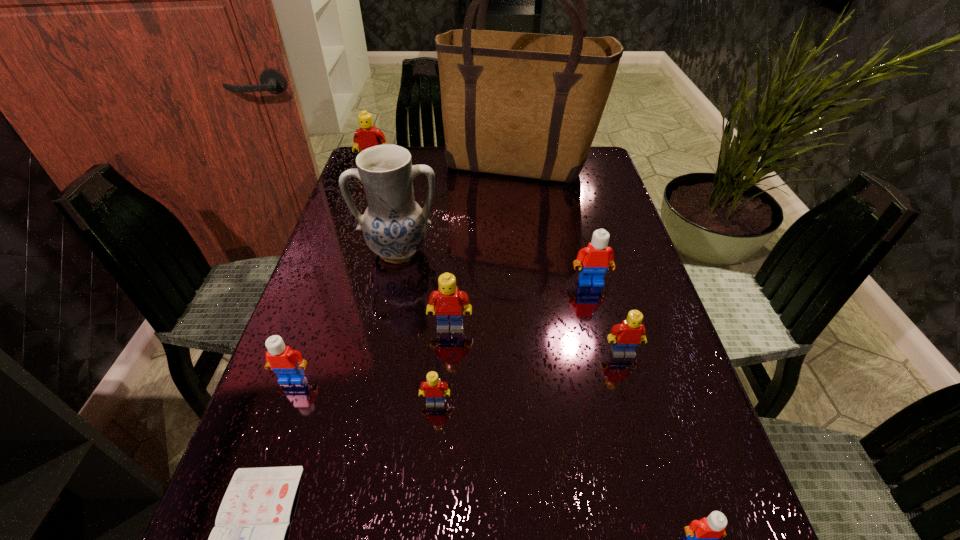
The image size is (960, 540). I want to click on the leftmost white Lego, so click(x=286, y=363).

Find the location of a particular element. The height and width of the screenshot is (540, 960). the rightmost yellow Lego is located at coordinates point(626,336).

Locate an element on the screen. the third biggest yellow Lego is located at coordinates (626, 336).

Where is `the nearest yellow Lego`? This screenshot has height=540, width=960. the nearest yellow Lego is located at coordinates (433, 389).

Locate an element on the screen. the smallest yellow Lego is located at coordinates 433,389.

Locate an element on the screen. The image size is (960, 540). vacant space located 0.110m on the front of the tote bag is located at coordinates click(523, 210).

The image size is (960, 540). In order to click on vacant space located 0.250m on the right of the blue pottery in this screenshot , I will do `click(540, 252)`.

Identify the location of free space located on the front-facing side of the farthest yellow Lego. (356, 220).

Image resolution: width=960 pixels, height=540 pixels. In order to click on free location located 0.320m on the front-facing side of the third smallest yellow Lego in this screenshot , I will do `click(440, 494)`.

Identify the location of free spot located 0.330m on the face of the farthest white Lego. (626, 420).